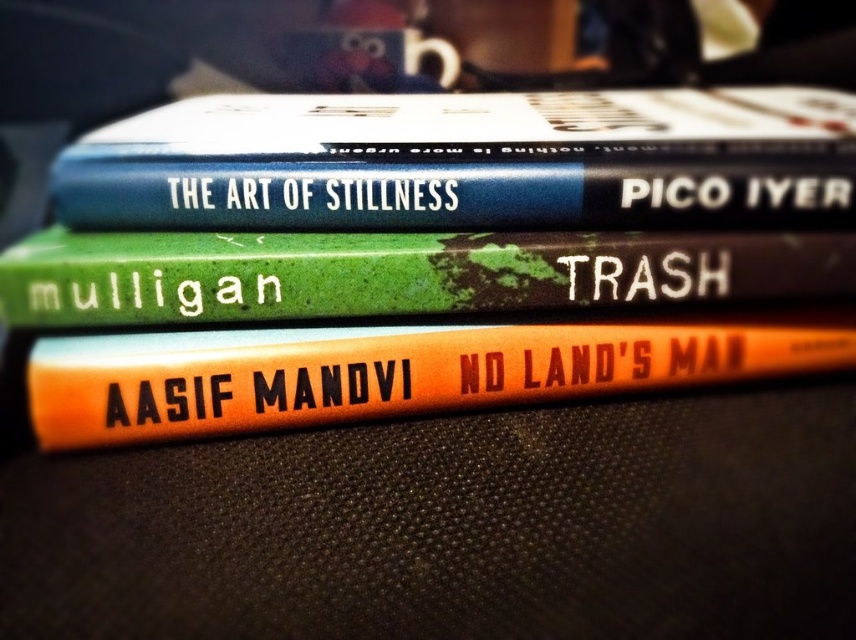
What object is located at the coordinates point [467,161] in the image?

The point [467,161] indicates a hardcover book at center.

You are organizing a bookshelf and need to place the hardcover book at center and the green matte book at center. According to their positions in the image, which book should you place first on the shelf if you want to maintain their original arrangement?

The green matte book at center should be placed first on the shelf because the hardcover book at center is to the right of it in the image, meaning the green matte book is on the left side.

You are standing in front of the stack of three books. There is an orange matte book at center located at point (384, 371). Is the orange matte book at center the middle book in the stack?

Yes, the orange matte book at center is the middle book in the stack because it is located at point (384, 371).